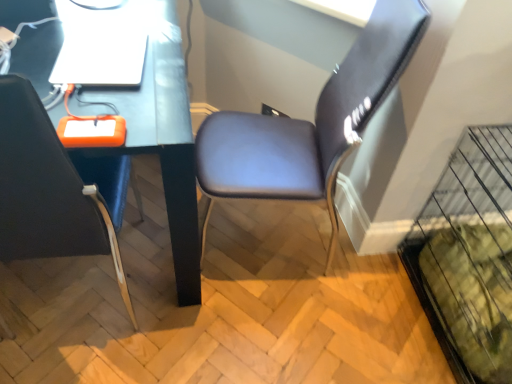
Question: Is matte black chair at left, placed as the 2th chair when sorted from right to left, to the left or to the right of suede-like brown chair at center-right, which is counted as the 1th chair, starting from the right, in the image?

Choices:
 (A) right
 (B) left

Answer: (B)

Question: From the image's perspective, is matte black chair at left, placed as the 2th chair when sorted from right to left, positioned above or below suede-like brown chair at center-right, which appears as the 2th chair when viewed from the left?

Choices:
 (A) below
 (B) above

Answer: (A)

Question: Estimate the real-world distances between objects in this image. Which object is closer to the white glossy laptop at upper left?

Choices:
 (A) suede-like brown chair at center-right, which is counted as the 1th chair, starting from the right
 (B) matte black chair at left, which is the 1th chair from left to right
 (C) matte black desk at center

Answer: (C)

Question: Which of these objects is positioned farthest from the matte black chair at left, placed as the 2th chair when sorted from right to left?

Choices:
 (A) matte black desk at center
 (B) suede-like brown chair at center-right, which is counted as the 1th chair, starting from the right
 (C) white glossy laptop at upper left

Answer: (B)